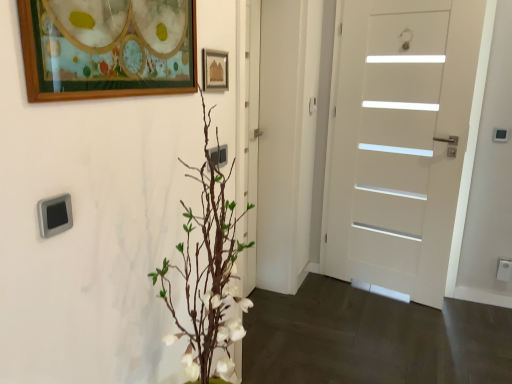
Question: From the image's perspective, would you say wooden picture frame at upper left, the 2th picture frame when ordered from back to front, is positioned over wooden picture frame at upper center, acting as the first picture frame starting from the back?

Choices:
 (A) yes
 (B) no

Answer: (B)

Question: Does wooden picture frame at upper left, the 1th picture frame viewed from the left, come behind wooden picture frame at upper center, acting as the first picture frame starting from the back?

Choices:
 (A) no
 (B) yes

Answer: (A)

Question: Is wooden picture frame at upper left, the first picture frame in the front-to-back sequence, aimed at wooden picture frame at upper center, which appears as the 2th picture frame when viewed from the left?

Choices:
 (A) no
 (B) yes

Answer: (A)

Question: Is wooden picture frame at upper left, the 1th picture frame viewed from the left, taller than wooden picture frame at upper center, which appears as the 2th picture frame when viewed from the left?

Choices:
 (A) yes
 (B) no

Answer: (A)

Question: Is wooden picture frame at upper center, which appears as the 2th picture frame when viewed from the left, at the back of wooden picture frame at upper left, the 1th picture frame viewed from the left?

Choices:
 (A) no
 (B) yes

Answer: (A)

Question: In terms of width, does satin silver door handle at upper center look wider or thinner when compared to wooden picture frame at upper left, the 2th picture frame when ordered from back to front?

Choices:
 (A) thin
 (B) wide

Answer: (B)

Question: From their relative heights in the image, would you say satin silver door handle at upper center is taller or shorter than wooden picture frame at upper left, the 2th picture frame when ordered from back to front?

Choices:
 (A) tall
 (B) short

Answer: (B)

Question: Do you think satin silver door handle at upper center is within wooden picture frame at upper left, the first picture frame in the front-to-back sequence, or outside of it?

Choices:
 (A) inside
 (B) outside

Answer: (B)

Question: Is satin silver door handle at upper center in front of or behind wooden picture frame at upper left, the first picture frame in the front-to-back sequence, in the image?

Choices:
 (A) behind
 (B) front

Answer: (A)

Question: Looking at the image, does white matte door at right seem bigger or smaller compared to wooden picture frame at upper left, the first picture frame in the front-to-back sequence?

Choices:
 (A) small
 (B) big

Answer: (B)

Question: From a real-world perspective, relative to wooden picture frame at upper left, the second picture frame in the right-to-left sequence, is white matte door at right vertically above or below?

Choices:
 (A) above
 (B) below

Answer: (B)

Question: Considering the positions of white matte door at right and wooden picture frame at upper left, the 2th picture frame when ordered from back to front, in the image, is white matte door at right wider or thinner than wooden picture frame at upper left, the 2th picture frame when ordered from back to front,?

Choices:
 (A) thin
 (B) wide

Answer: (B)

Question: Is white matte door at right in front of or behind wooden picture frame at upper left, the first picture frame in the front-to-back sequence, in the image?

Choices:
 (A) front
 (B) behind

Answer: (B)

Question: Is satin silver outlet at center, which is the first electric outlet from top to bottom, in front of or behind wooden picture frame at upper center, which appears as the 2th picture frame when viewed from the left, in the image?

Choices:
 (A) behind
 (B) front

Answer: (A)

Question: From a real-world perspective, is satin silver outlet at center, which is counted as the 2th electric outlet, starting from the back, positioned above or below wooden picture frame at upper center, which appears as the 2th picture frame when viewed from the left?

Choices:
 (A) below
 (B) above

Answer: (A)